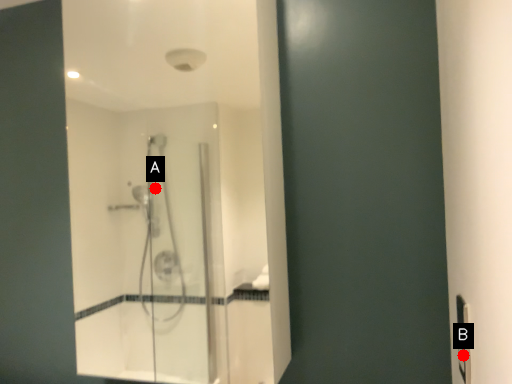
Question: Two points are circled on the image, labeled by A and B beside each circle. Which point is closer to the camera?

Choices:
 (A) A is closer
 (B) B is closer

Answer: (B)